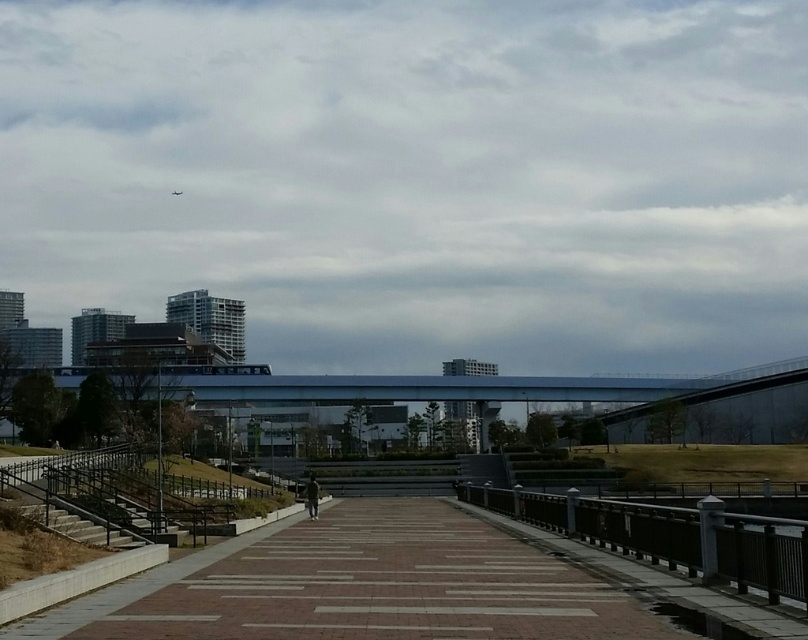
You are a city planner analyzing the urban layout. You need to determine which of the two structures, the brick paved walkway at center or the blue glass pedestrian bridge at center, occupies a larger area in the image. Based on the scene description, which one is bigger?

The blue glass pedestrian bridge at center is larger than the brick paved walkway at center according to the description.

You are a delivery person carrying a large package that is 1.8 meters tall. You need to walk through the pathway between the metallic gray railing at center and the blue glass pedestrian bridge at center. Can your package pass through without hitting anything?

The metallic gray railing at center has a lesser height compared to blue glass pedestrian bridge at center. Since the railing is shorter, the lowest obstacle your package might hit is the railing. However, the package is 1.8 meters tall, and the railing is the shorter one. If the railing is lower than 1.8 meters, the package might hit it. But since the description only states the railing is shorter than the bridge, but doesn not provide exact measurements, we cannot confirm. However, typically railings are

You are standing on the pedestrian pathway and want to locate the metallic gray railing at center. According to the scene description, where would you find it?

The metallic gray railing at center is located at the 2D coordinates point (667, 536).